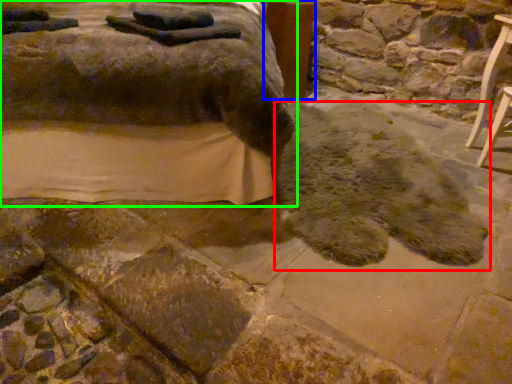
Question: Considering the real-world distances, which object is farthest from footprint (highlighted by a red box)? table (highlighted by a blue box) or furniture (highlighted by a green box)?

Choices:
 (A) table
 (B) furniture

Answer: (A)